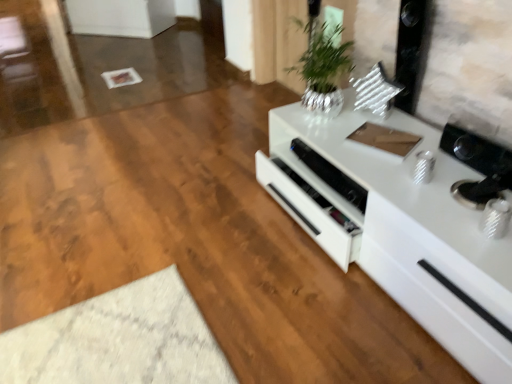
In order to click on free space to the left of white glossy cabinet at right in this screenshot , I will do `click(186, 251)`.